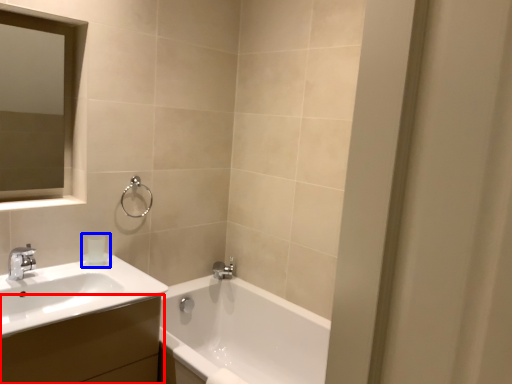
Question: Which point is closer to the camera, bathroom cabinet (highlighted by a red box) or toiletry (highlighted by a blue box)?

Choices:
 (A) bathroom cabinet
 (B) toiletry

Answer: (A)